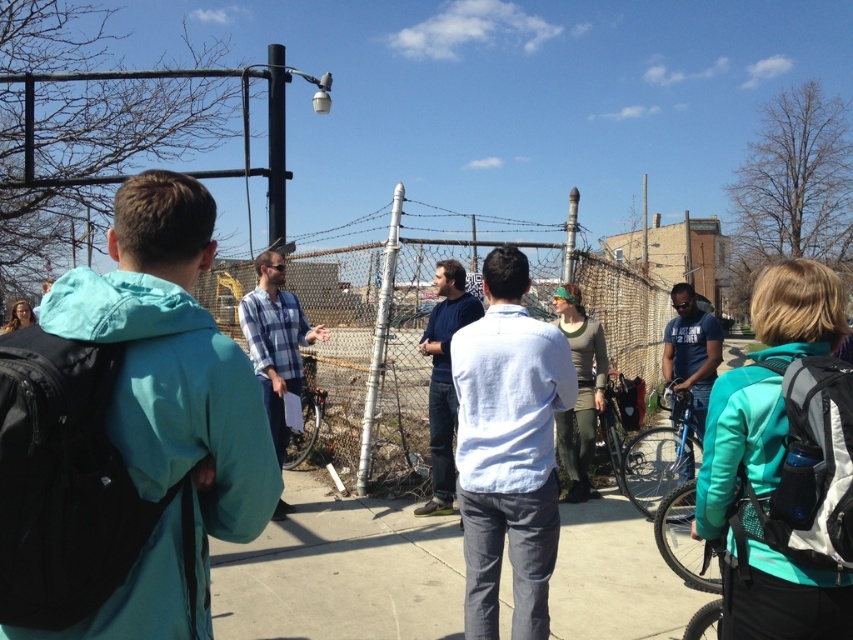
Is point (3, 428) positioned before point (701, 433)?

Yes.

Is teal fabric jacket at left wider than blue cotton shirt at center?

Yes.

At what (x,y) coordinates should I click in order to perform the action: click on teal fabric jacket at left. Please return your answer as a coordinate pair (x, y). The width and height of the screenshot is (853, 640). Looking at the image, I should click on (126, 436).

Is white cotton shirt at center bigger than green knitted hat at center?

Actually, white cotton shirt at center might be smaller than green knitted hat at center.

I want to click on white cotton shirt at center, so click(508, 449).

Is point (480, 339) behind point (596, 340)?

No, (480, 339) is closer to viewer.

Locate an element on the screen. white cotton shirt at center is located at coordinates (508, 449).

Does teal fabric backpack at lower right appear under green knitted hat at center?

Indeed, teal fabric backpack at lower right is positioned under green knitted hat at center.

Consider the image. Does teal fabric backpack at lower right have a lesser width compared to green knitted hat at center?

Yes.

Is point (822, 573) positioned after point (572, 486)?

That is False.

Identify the location of teal fabric backpack at lower right. The height and width of the screenshot is (640, 853). (753, 540).